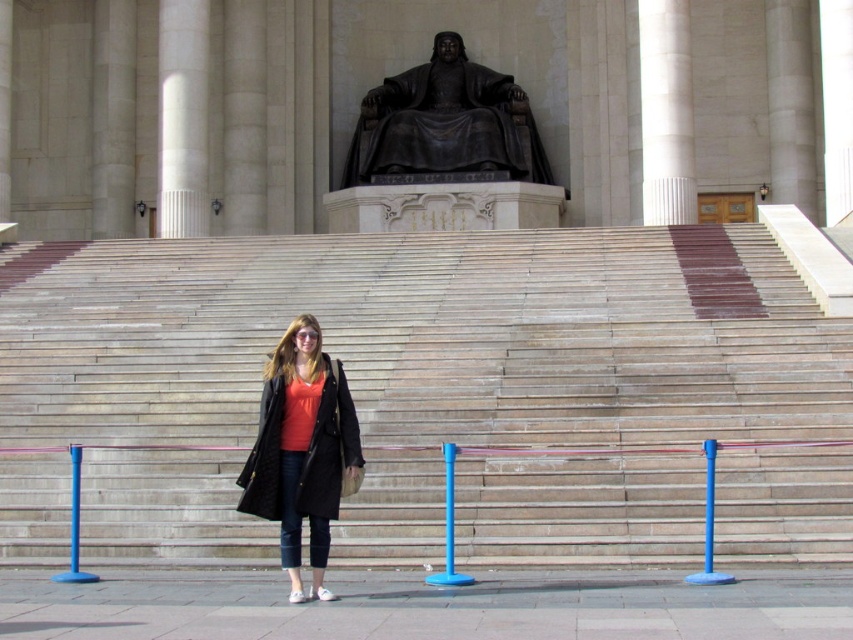
Question: Which point is closer to the camera?

Choices:
 (A) wooden stairs at center
 (B) white marble column at left
 (C) black polished stone statue at upper center

Answer: (A)

Question: Can you confirm if black polished stone statue at upper center is positioned to the left of matte black coat at center?

Choices:
 (A) no
 (B) yes

Answer: (A)

Question: Which object appears farthest from the camera in this image?

Choices:
 (A) white marble column at upper center
 (B) black polished stone statue at upper center
 (C) matte black coat at center
 (D) wooden stairs at center

Answer: (B)

Question: Estimate the real-world distances between objects in this image. Which object is farther from the wooden stairs at center?

Choices:
 (A) black polished stone statue at upper center
 (B) white marble column at upper center
 (C) matte black coat at center
 (D) white marble column at left

Answer: (A)

Question: Does matte black coat at center appear on the left side of white marble column at left?

Choices:
 (A) no
 (B) yes

Answer: (A)

Question: Does black polished stone statue at upper center have a greater width compared to white marble column at left?

Choices:
 (A) yes
 (B) no

Answer: (A)